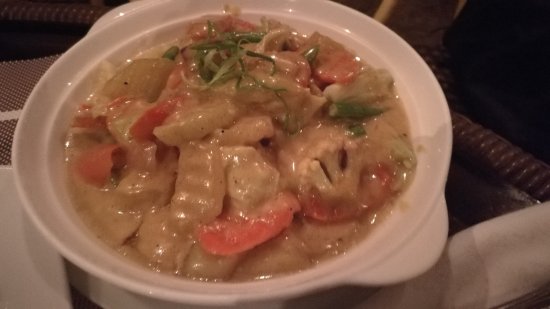
The height and width of the screenshot is (309, 550). What are the coordinates of `placemat` in the screenshot? It's located at (22, 81).